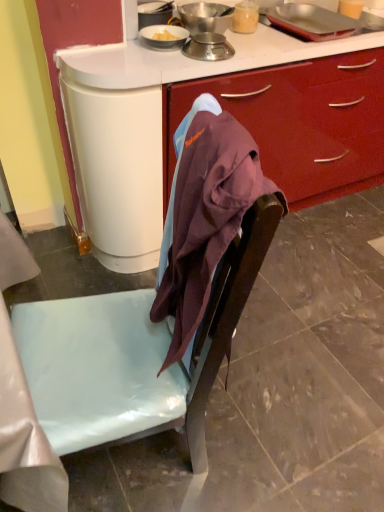
Question: Does metallic silver tray at upper right, positioned as the 3th kitchen appliance in left-to-right order, lie in front of metallic silver scale at upper center, the first kitchen appliance in the left-to-right sequence?

Choices:
 (A) yes
 (B) no

Answer: (B)

Question: Is metallic silver tray at upper right, positioned as the 3th kitchen appliance in left-to-right order, next to metallic silver scale at upper center, placed as the 3th kitchen appliance when sorted from right to left?

Choices:
 (A) no
 (B) yes

Answer: (A)

Question: From the image's perspective, is metallic silver tray at upper right, positioned as the 3th kitchen appliance in left-to-right order, on metallic silver scale at upper center, the first kitchen appliance in the left-to-right sequence?

Choices:
 (A) no
 (B) yes

Answer: (B)

Question: Is metallic silver tray at upper right, which appears as the first kitchen appliance when viewed from the right, outside of metallic silver scale at upper center, placed as the 3th kitchen appliance when sorted from right to left?

Choices:
 (A) no
 (B) yes

Answer: (B)

Question: Can you confirm if metallic silver tray at upper right, positioned as the 3th kitchen appliance in left-to-right order, is smaller than metallic silver scale at upper center, placed as the 3th kitchen appliance when sorted from right to left?

Choices:
 (A) no
 (B) yes

Answer: (A)

Question: Is metallic silver scale at upper center, which appears as the 2th kitchen appliance when viewed from the left, taller or shorter than matte brown chair at center?

Choices:
 (A) tall
 (B) short

Answer: (A)

Question: Considering the relative positions of metallic silver scale at upper center, the 2th kitchen appliance positioned from the right, and matte brown chair at center in the image provided, is metallic silver scale at upper center, the 2th kitchen appliance positioned from the right, to the left or to the right of matte brown chair at center?

Choices:
 (A) right
 (B) left

Answer: (B)

Question: From a real-world perspective, is metallic silver scale at upper center, which appears as the 2th kitchen appliance when viewed from the left, physically located above or below matte brown chair at center?

Choices:
 (A) below
 (B) above

Answer: (B)

Question: Is point (223, 45) closer or farther from the camera than point (172, 377)?

Choices:
 (A) farther
 (B) closer

Answer: (A)

Question: From the image's perspective, relative to metallic silver scale at upper center, placed as the 3th kitchen appliance when sorted from right to left, is metallic silver tray at upper right, positioned as the 3th kitchen appliance in left-to-right order, above or below?

Choices:
 (A) above
 (B) below

Answer: (A)

Question: Do you think metallic silver tray at upper right, which appears as the first kitchen appliance when viewed from the right, is within metallic silver scale at upper center, the first kitchen appliance in the left-to-right sequence, or outside of it?

Choices:
 (A) inside
 (B) outside

Answer: (B)

Question: Considering the positions of metallic silver tray at upper right, which appears as the first kitchen appliance when viewed from the right, and metallic silver scale at upper center, the first kitchen appliance in the left-to-right sequence, in the image, is metallic silver tray at upper right, which appears as the first kitchen appliance when viewed from the right, taller or shorter than metallic silver scale at upper center, the first kitchen appliance in the left-to-right sequence,?

Choices:
 (A) tall
 (B) short

Answer: (B)

Question: Considering the positions of metallic silver tray at upper right, positioned as the 3th kitchen appliance in left-to-right order, and metallic silver scale at upper center, the first kitchen appliance in the left-to-right sequence, in the image, is metallic silver tray at upper right, positioned as the 3th kitchen appliance in left-to-right order, bigger or smaller than metallic silver scale at upper center, the first kitchen appliance in the left-to-right sequence,?

Choices:
 (A) big
 (B) small

Answer: (A)

Question: Is metallic silver scale at upper center, placed as the 3th kitchen appliance when sorted from right to left, bigger or smaller than metallic silver scale at upper center, the 2th kitchen appliance positioned from the right?

Choices:
 (A) small
 (B) big

Answer: (B)

Question: In terms of width, does metallic silver scale at upper center, the first kitchen appliance in the left-to-right sequence, look wider or thinner when compared to metallic silver scale at upper center, which appears as the 2th kitchen appliance when viewed from the left?

Choices:
 (A) wide
 (B) thin

Answer: (A)